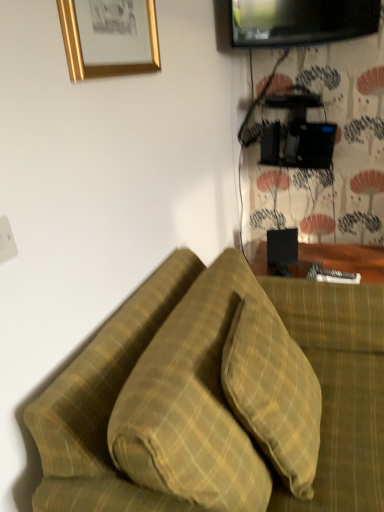
Question: From a real-world perspective, is black glossy tv at upper right positioned above or below gold metallic picture frame at upper left?

Choices:
 (A) above
 (B) below

Answer: (A)

Question: From the image's perspective, is black glossy tv at upper right positioned above or below gold metallic picture frame at upper left?

Choices:
 (A) below
 (B) above

Answer: (B)

Question: Which object is the closest to the yellow plaid pillow at center, the first pillow viewed from the right?

Choices:
 (A) black glossy tv at upper right
 (B) gold metallic picture frame at upper left
 (C) green plaid pillow at center, which ranks as the first pillow in left-to-right order

Answer: (C)

Question: Which object is positioned farthest from the yellow plaid pillow at center, the second pillow when ordered from left to right?

Choices:
 (A) gold metallic picture frame at upper left
 (B) green plaid pillow at center, positioned as the 2th pillow in right-to-left order
 (C) black glossy tv at upper right

Answer: (C)